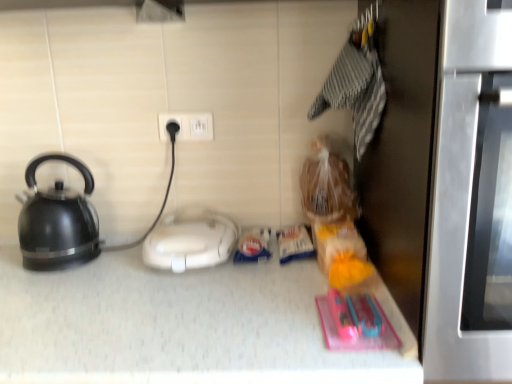
Question: Relative to stainless steel oven at right, is white plastic appliance at center in front or behind?

Choices:
 (A) front
 (B) behind

Answer: (B)

Question: From a real-world perspective, relative to stainless steel oven at right, is white plastic appliance at center vertically above or below?

Choices:
 (A) above
 (B) below

Answer: (B)

Question: Estimate the real-world distances between objects in this image. Which object is closer to the white plastic appliance at center?

Choices:
 (A) stainless steel oven at right
 (B) matte black kettle at left
 (C) white plastic electric outlet at center

Answer: (B)

Question: Which of these objects is positioned farthest from the white plastic appliance at center?

Choices:
 (A) stainless steel oven at right
 (B) white plastic electric outlet at center
 (C) matte black kettle at left

Answer: (A)